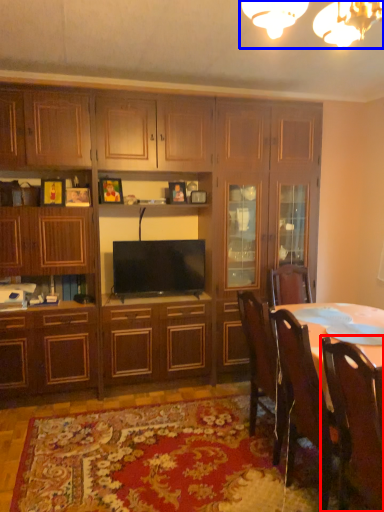
Question: Which object is closer to the camera taking this photo, chair (highlighted by a red box) or light fixture (highlighted by a blue box)?

Choices:
 (A) chair
 (B) light fixture

Answer: (B)